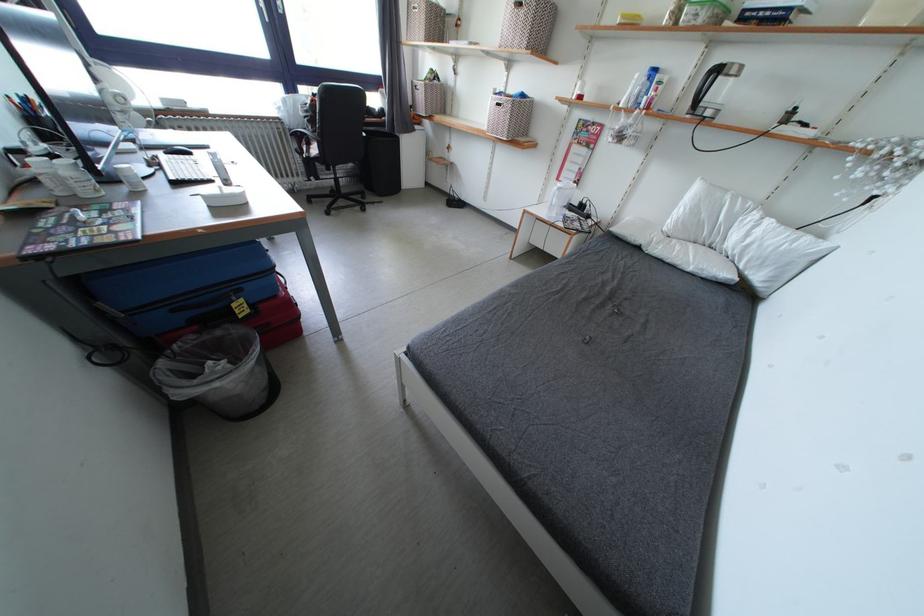
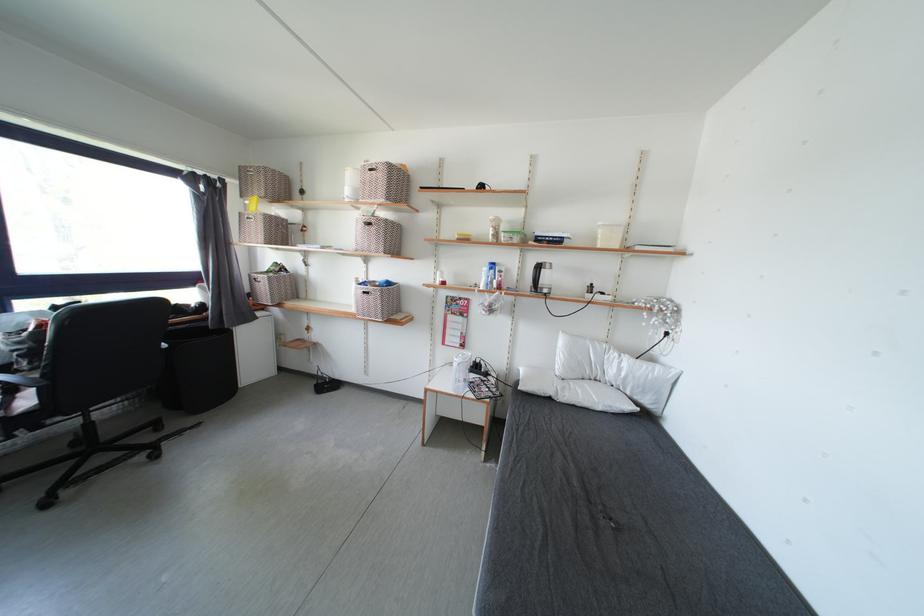
Where in the second image is the point corresponding to the point at 724,75 from the first image?

(545, 270)